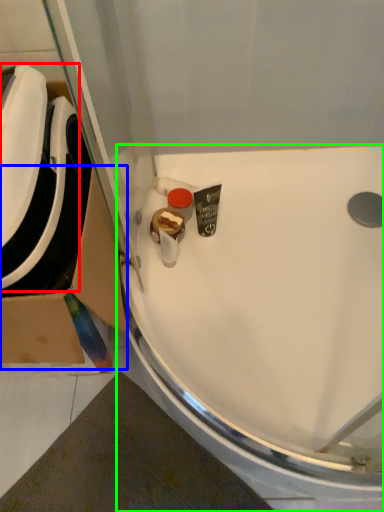
Question: Which object is the closest to the sink (highlighted by a red box)? Choose among these: cardboard box (highlighted by a blue box) or sink (highlighted by a green box).

Choices:
 (A) cardboard box
 (B) sink

Answer: (A)